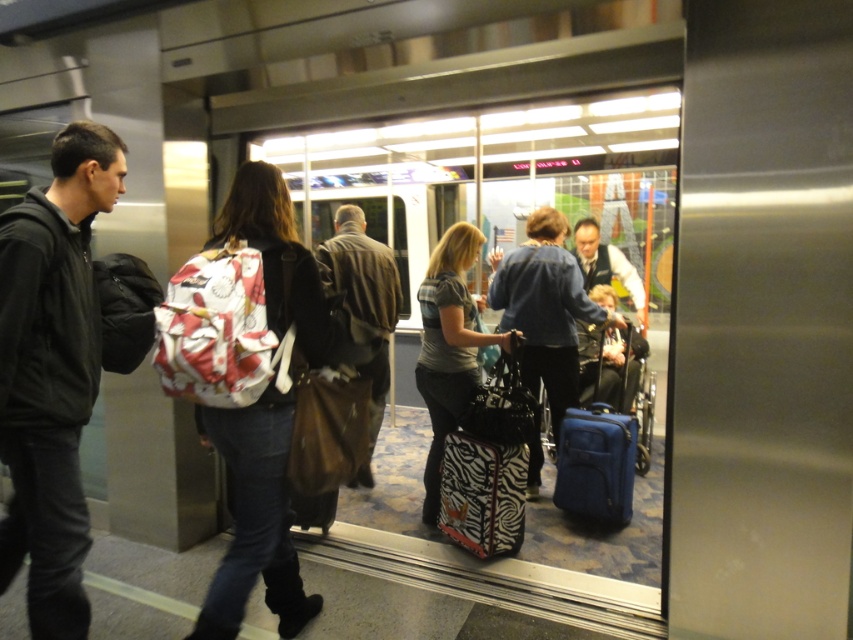
Question: Which point appears farthest from the camera in this image?

Choices:
 (A) (450, 492)
 (B) (341, 234)
 (C) (596, 497)

Answer: (B)

Question: Which point appears farthest from the camera in this image?

Choices:
 (A) (561, 451)
 (B) (378, 371)
 (C) (512, 362)

Answer: (B)

Question: From the image, what is the correct spatial relationship of zebra-patterned suitcase at center in relation to blue fabric suitcase at center?

Choices:
 (A) above
 (B) below

Answer: (A)

Question: Does brown leather jacket at center come in front of blue fabric wheelchair at center?

Choices:
 (A) yes
 (B) no

Answer: (A)

Question: Does brown leather jacket at center come in front of blue fabric wheelchair at center?

Choices:
 (A) yes
 (B) no

Answer: (A)

Question: Which of these objects is positioned farthest from the black matte jacket at left?

Choices:
 (A) brown leather jacket at center
 (B) blue fabric suitcase at center
 (C) blue fabric wheelchair at center
 (D) zebra-patterned suitcase at center

Answer: (C)